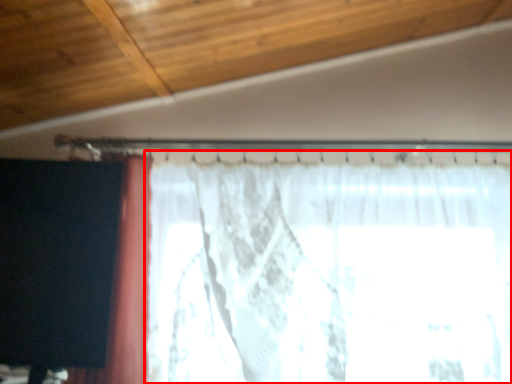
Question: Observing the image, what is the correct spatial positioning of curtain (annotated by the red box) in reference to curtain?

Choices:
 (A) right
 (B) left

Answer: (A)